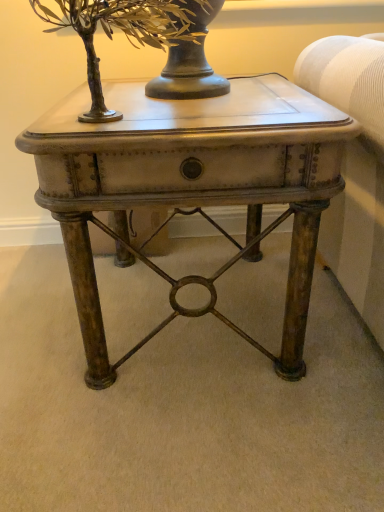
Question: Considering their positions, is green metallic tree at upper center located in front of or behind matte brown side table at center?

Choices:
 (A) front
 (B) behind

Answer: (A)

Question: Is point (94, 52) positioned closer to the camera than point (142, 133)?

Choices:
 (A) closer
 (B) farther

Answer: (B)

Question: From a real-world perspective, is green metallic tree at upper center above or below matte brown side table at center?

Choices:
 (A) below
 (B) above

Answer: (B)

Question: From the image's perspective, is matte brown side table at center located above or below green metallic tree at upper center?

Choices:
 (A) below
 (B) above

Answer: (A)

Question: From their relative heights in the image, would you say matte brown side table at center is taller or shorter than green metallic tree at upper center?

Choices:
 (A) short
 (B) tall

Answer: (B)

Question: From a real-world perspective, is matte brown side table at center above or below green metallic tree at upper center?

Choices:
 (A) below
 (B) above

Answer: (A)

Question: Is matte brown side table at center bigger or smaller than green metallic tree at upper center?

Choices:
 (A) small
 (B) big

Answer: (B)